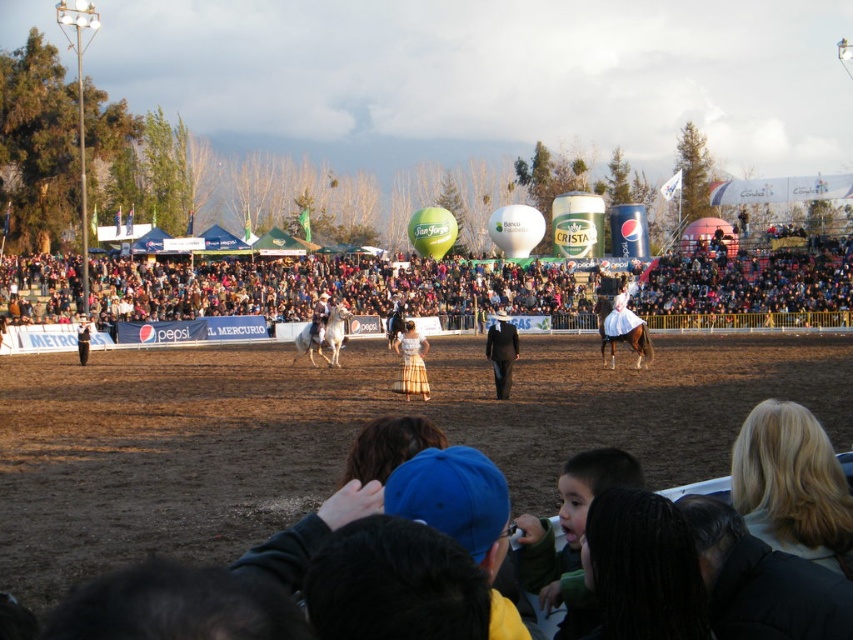
You are standing at the point marked as point (x=514, y=209) in the arena. You want to take a photo of the entire rodeo scene with a camera that has a maximum zoom range of 100 meters. Will you be able to capture the entire scene without moving closer?

The distance between point (x=514, y=209) and the camera is 120.45 meters. Since the camera can only zoom up to 100 meters, you won question be able to capture the entire scene without moving closer.

Based on the photo, you are a photographer at the rodeo event. You want to take a photo that includes both the white glossy balloon at upper center and the white glossy horse at center. Which object should you focus on first if you want to ensure both are in frame?

You should focus on the white glossy horse at center first because the white glossy balloon at upper center is bigger, so adjusting the frame to include the larger balloon will naturally include the smaller horse as well.

You are standing at point (769, 477) and want to reach the center of the arena. The arena has a radius of 25 meters. Can you safely walk straight to the center without crossing the fence?

The distance from point (769, 477) to the center is 23.07 meters, which is less than the arena radius of 25 meters. Therefore, walking straight to the center is safe as you won t cross the fence.